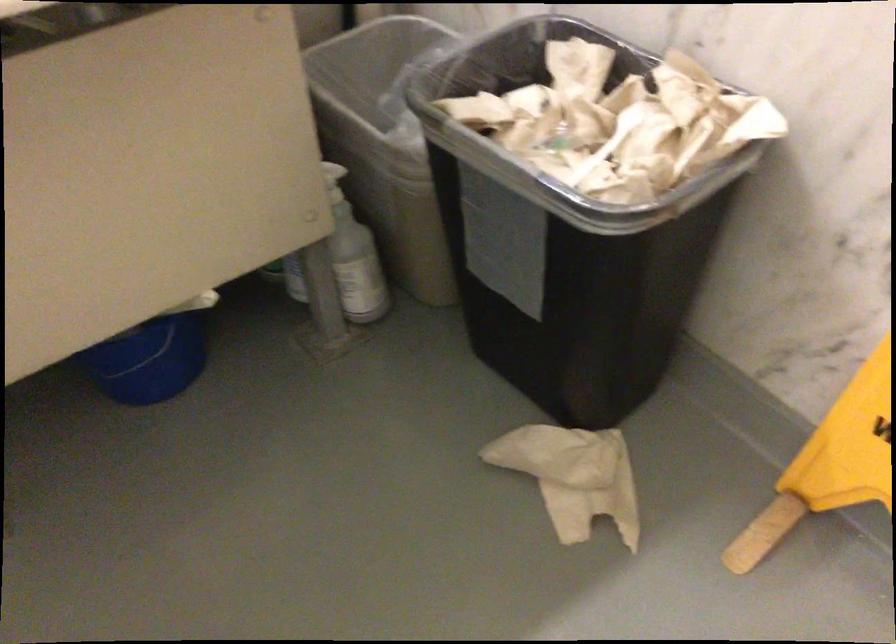
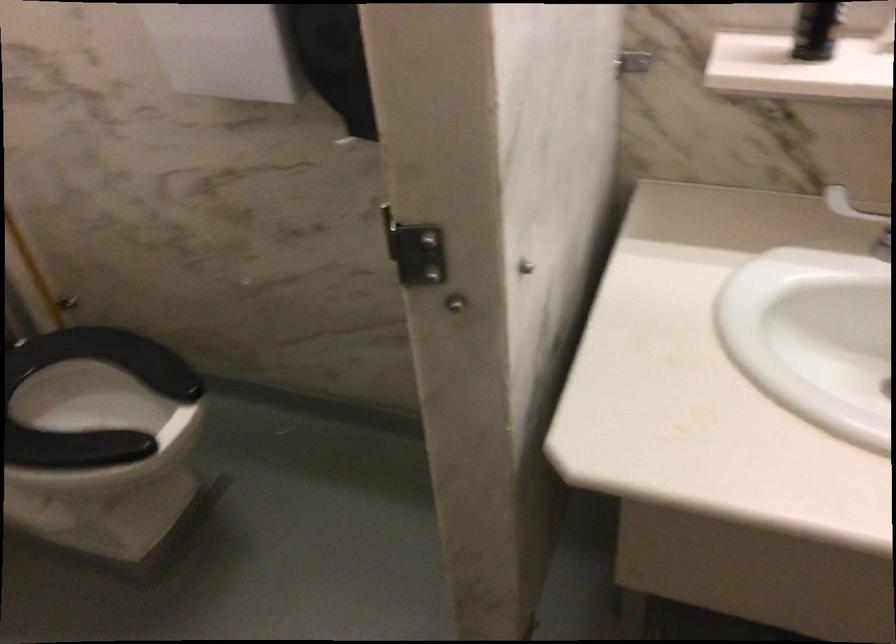
Question: Based on the continuous images, in which direction is the camera rotating? Reply with the corresponding letter.

Choices:
 (A) Left
 (B) Right
 (C) Up
 (D) Down

Answer: (A)